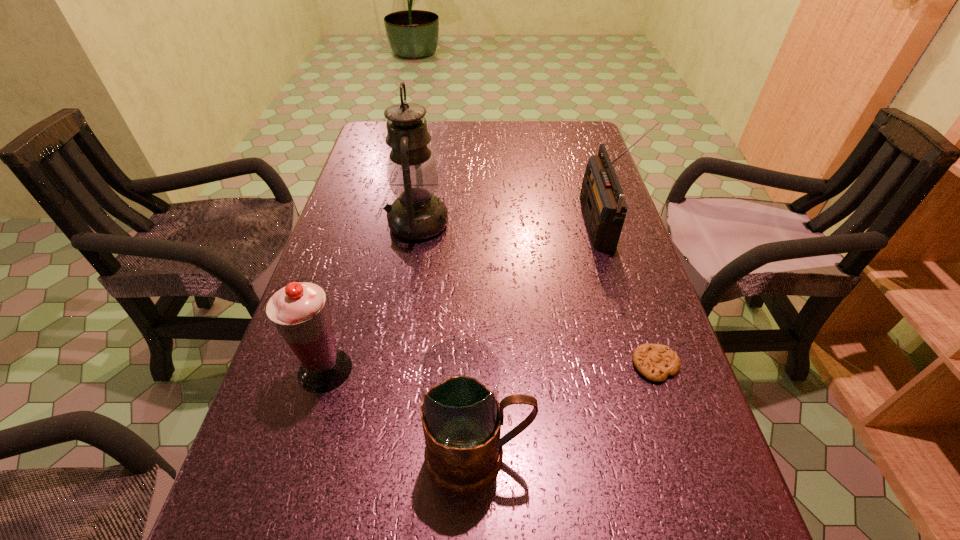
Locate an element on the screen. The image size is (960, 540). vacant space that's between the radio receiver and the smoothie is located at coordinates (462, 297).

Identify the location of free space between the radio receiver and the pitcher. (538, 339).

This screenshot has height=540, width=960. I want to click on vacant point located between the pitcher and the radio receiver, so click(538, 339).

Where is `vacant area that lies between the radio receiver and the smoothie`? This screenshot has height=540, width=960. vacant area that lies between the radio receiver and the smoothie is located at coordinates (462, 297).

The height and width of the screenshot is (540, 960). What are the coordinates of `unoccupied position between the oil lamp and the radio receiver` in the screenshot? It's located at (508, 224).

The width and height of the screenshot is (960, 540). What are the coordinates of `free space between the smoothie and the pitcher` in the screenshot? It's located at (401, 412).

The width and height of the screenshot is (960, 540). What are the coordinates of `unoccupied position between the nearest object and the cookie` in the screenshot? It's located at tap(566, 409).

The height and width of the screenshot is (540, 960). Find the location of `free space between the radio receiver and the shortest object`. free space between the radio receiver and the shortest object is located at coordinates (627, 295).

Where is `vacant point located between the oil lamp and the smoothie`? The width and height of the screenshot is (960, 540). vacant point located between the oil lamp and the smoothie is located at coordinates (372, 297).

At what (x,y) coordinates should I click in order to perform the action: click on vacant region between the shortest object and the oil lamp. Please return your answer as a coordinate pair (x, y). The width and height of the screenshot is (960, 540). Looking at the image, I should click on (537, 294).